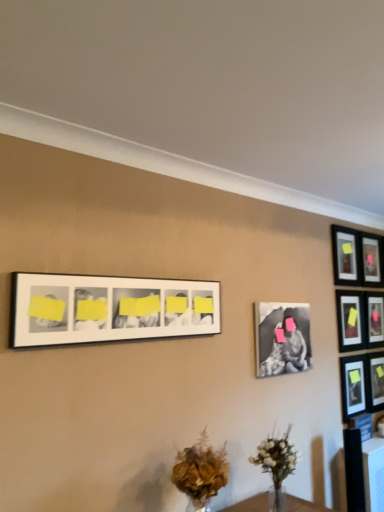
Question: Is matte black picture frame at right, the fourth picture frame positioned from the right, taller than matte black picture frame at upper right, placed as the third picture frame when sorted from left to right?

Choices:
 (A) no
 (B) yes

Answer: (B)

Question: Considering the relative sizes of matte black picture frame at right, which is counted as the 5th picture frame, starting from the left, and matte black picture frame at upper right, the sixth picture frame positioned from the right, in the image provided, is matte black picture frame at right, which is counted as the 5th picture frame, starting from the left, bigger than matte black picture frame at upper right, the sixth picture frame positioned from the right,?

Choices:
 (A) yes
 (B) no

Answer: (B)

Question: Are matte black picture frame at right, the fourth picture frame positioned from the right, and matte black picture frame at upper right, the sixth picture frame positioned from the right, located far from each other?

Choices:
 (A) yes
 (B) no

Answer: (B)

Question: Is matte black picture frame at right, which is counted as the 5th picture frame, starting from the left, shorter than matte black picture frame at upper right, the sixth picture frame positioned from the right?

Choices:
 (A) no
 (B) yes

Answer: (A)

Question: From the image's perspective, is matte black picture frame at right, which is counted as the 5th picture frame, starting from the left, located beneath matte black picture frame at upper right, the sixth picture frame positioned from the right?

Choices:
 (A) no
 (B) yes

Answer: (B)

Question: Does matte black picture frame at right, the fourth picture frame positioned from the right, appear on the right side of matte black picture frame at upper right, the sixth picture frame positioned from the right?

Choices:
 (A) yes
 (B) no

Answer: (A)

Question: Is white matte picture frame at upper center, the 8th picture frame viewed from the right, in front of matte black picture frame at right, which is counted as the 5th picture frame, starting from the left?

Choices:
 (A) yes
 (B) no

Answer: (A)

Question: Does white matte picture frame at upper center, the 8th picture frame viewed from the right, have a larger size compared to matte black picture frame at right, which is counted as the 5th picture frame, starting from the left?

Choices:
 (A) yes
 (B) no

Answer: (A)

Question: Does white matte picture frame at upper center, which is the 1th picture frame in left-to-right order, contain matte black picture frame at right, the fourth picture frame positioned from the right?

Choices:
 (A) no
 (B) yes

Answer: (A)

Question: Is white matte picture frame at upper center, the 8th picture frame viewed from the right, smaller than matte black picture frame at right, which is counted as the 5th picture frame, starting from the left?

Choices:
 (A) no
 (B) yes

Answer: (A)

Question: From a real-world perspective, is white matte picture frame at upper center, which is the 1th picture frame in left-to-right order, located beneath matte black picture frame at right, the fourth picture frame positioned from the right?

Choices:
 (A) no
 (B) yes

Answer: (A)

Question: Considering the relative sizes of white matte picture frame at upper center, the 8th picture frame viewed from the right, and matte black picture frame at right, which is counted as the 5th picture frame, starting from the left, in the image provided, is white matte picture frame at upper center, the 8th picture frame viewed from the right, wider than matte black picture frame at right, which is counted as the 5th picture frame, starting from the left,?

Choices:
 (A) yes
 (B) no

Answer: (A)

Question: From the image's perspective, would you say brown textured bouquet at lower center is positioned over matte black picture frame at upper right, which ranks as the third picture frame in right-to-left order?

Choices:
 (A) yes
 (B) no

Answer: (B)